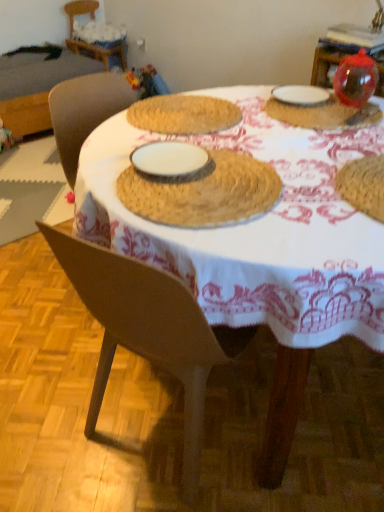
Question: Is woven straw placemat at upper left, which is counted as the 2th table, starting from the right, positioned before transparent plastic ball at upper right, the 2th tableware in the right-to-left sequence?

Choices:
 (A) no
 (B) yes

Answer: (A)

Question: Is woven straw placemat at upper left, arranged as the first table when viewed from the left, shorter than transparent plastic ball at upper right, the second tableware in the left-to-right sequence?

Choices:
 (A) yes
 (B) no

Answer: (B)

Question: Is woven straw placemat at upper left, the 1th table positioned from the top, located outside transparent plastic ball at upper right, the second tableware in the left-to-right sequence?

Choices:
 (A) yes
 (B) no

Answer: (A)

Question: Does woven straw placemat at upper left, which is counted as the 2th table, starting from the right, have a lesser width compared to transparent plastic ball at upper right, the second tableware in the left-to-right sequence?

Choices:
 (A) no
 (B) yes

Answer: (A)

Question: From a real-world perspective, is woven straw placemat at upper left, acting as the 2th table starting from the bottom, positioned under transparent plastic ball at upper right, the 2th tableware in the right-to-left sequence, based on gravity?

Choices:
 (A) no
 (B) yes

Answer: (B)

Question: Is woven straw placemat at center, which appears as the second table when viewed from the top, to the left or to the right of white ceramic plate at upper right, marked as the 3th tableware in a right-to-left arrangement, in the image?

Choices:
 (A) right
 (B) left

Answer: (B)

Question: From their relative heights in the image, would you say woven straw placemat at center, positioned as the 1th table in front-to-back order, is taller or shorter than white ceramic plate at upper right, marked as the 3th tableware in a right-to-left arrangement?

Choices:
 (A) tall
 (B) short

Answer: (A)

Question: Considering the positions of woven straw placemat at center, which is the second table in left-to-right order, and white ceramic plate at upper right, marked as the 3th tableware in a right-to-left arrangement, in the image, is woven straw placemat at center, which is the second table in left-to-right order, wider or thinner than white ceramic plate at upper right, marked as the 3th tableware in a right-to-left arrangement,?

Choices:
 (A) thin
 (B) wide

Answer: (B)

Question: From a real-world perspective, is woven straw placemat at center, the 1th table from the bottom, above or below white ceramic plate at upper right, the first tableware viewed from the left?

Choices:
 (A) below
 (B) above

Answer: (A)

Question: From a real-world perspective, is transparent plastic ball at upper right, the 2th tableware in the right-to-left sequence, above or below wooden chair at upper left?

Choices:
 (A) below
 (B) above

Answer: (B)

Question: Considering the positions of transparent plastic ball at upper right, the second tableware in the left-to-right sequence, and wooden chair at upper left in the image, is transparent plastic ball at upper right, the second tableware in the left-to-right sequence, taller or shorter than wooden chair at upper left?

Choices:
 (A) short
 (B) tall

Answer: (A)

Question: Looking at the image, does transparent plastic ball at upper right, the second tableware in the left-to-right sequence, seem bigger or smaller compared to wooden chair at upper left?

Choices:
 (A) big
 (B) small

Answer: (B)

Question: In terms of width, does transparent plastic ball at upper right, the 2th tableware in the right-to-left sequence, look wider or thinner when compared to wooden chair at upper left?

Choices:
 (A) thin
 (B) wide

Answer: (A)

Question: Choose the correct answer: Is wooden chair at upper left inside woven straw placemat at center, the 1th table from the bottom, or outside it?

Choices:
 (A) outside
 (B) inside

Answer: (A)

Question: From a real-world perspective, relative to woven straw placemat at center, which is the second table in left-to-right order, is wooden chair at upper left vertically above or below?

Choices:
 (A) above
 (B) below

Answer: (B)